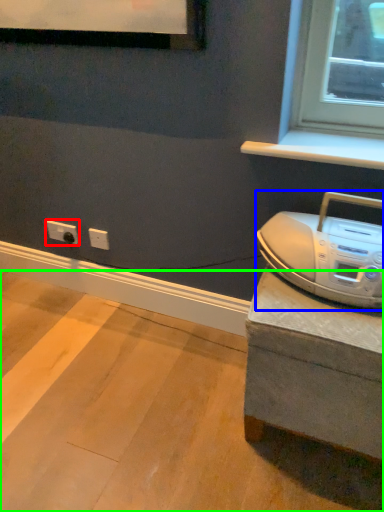
Question: Considering the real-world distances, which object is closest to electric outlet (highlighted by a red box)? home appliance (highlighted by a blue box) or concrete (highlighted by a green box).

Choices:
 (A) home appliance
 (B) concrete

Answer: (B)